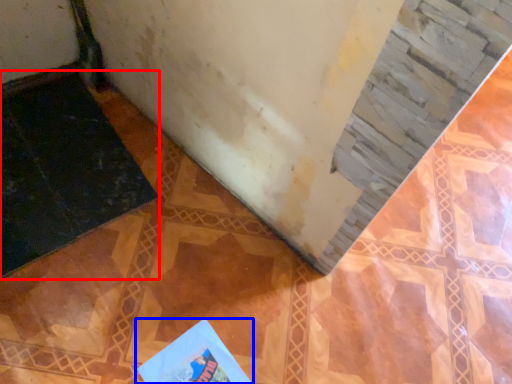
Question: Which point is closer to the camera, doormat (highlighted by a red box) or book (highlighted by a blue box)?

Choices:
 (A) doormat
 (B) book

Answer: (B)